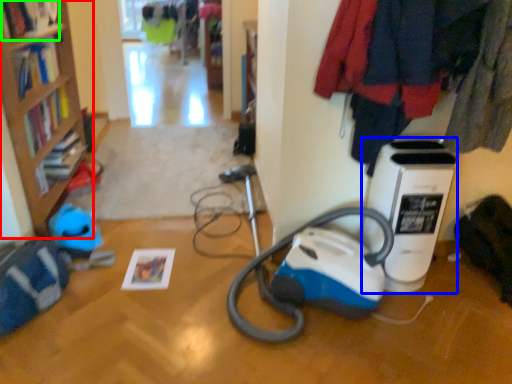
Question: Estimate the real-world distances between objects in this image. Which object is farther from bookcase (highlighted by a red box), home appliance (highlighted by a blue box) or book (highlighted by a green box)?

Choices:
 (A) home appliance
 (B) book

Answer: (A)